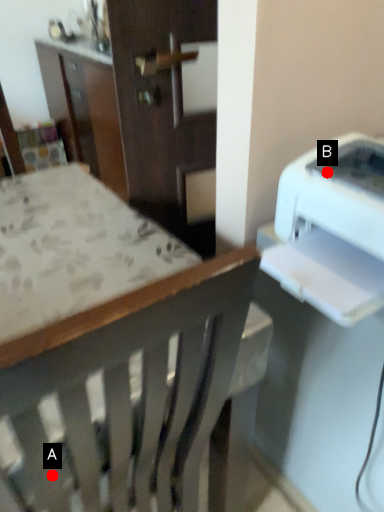
Question: Two points are circled on the image, labeled by A and B beside each circle. Among these points, which one is farthest from the camera?

Choices:
 (A) A is further
 (B) B is further

Answer: (B)